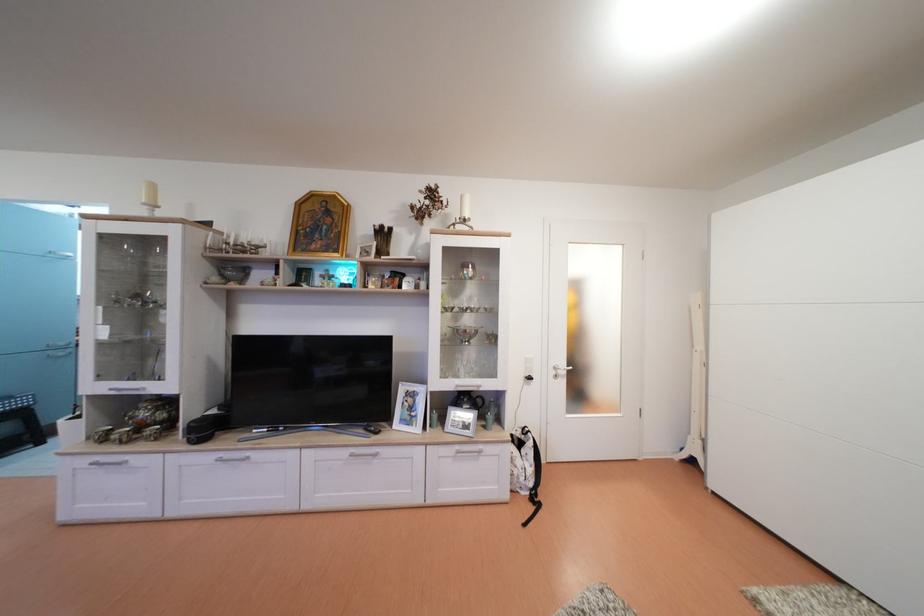
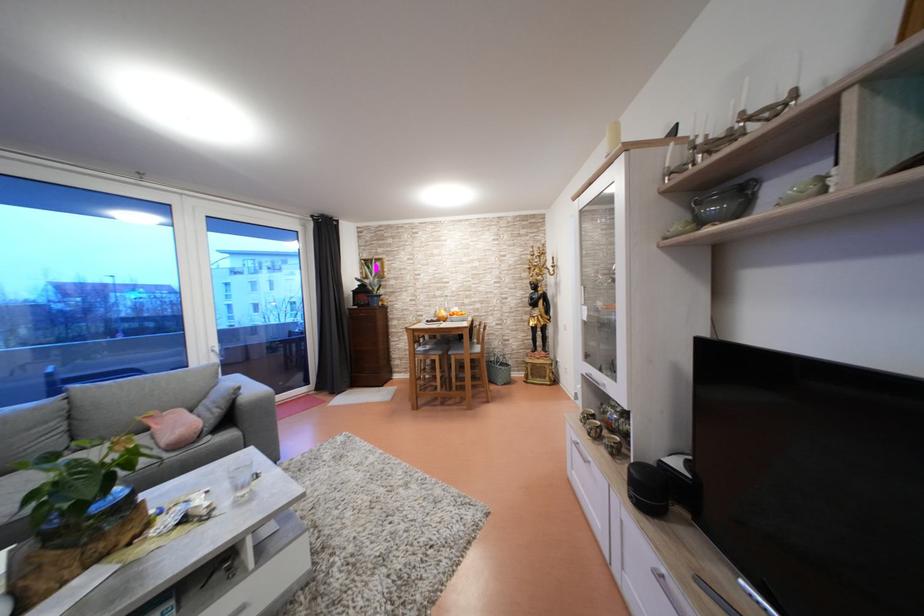
Find the pixel in the second image that matches the point at 251,270 in the first image.

(748, 185)